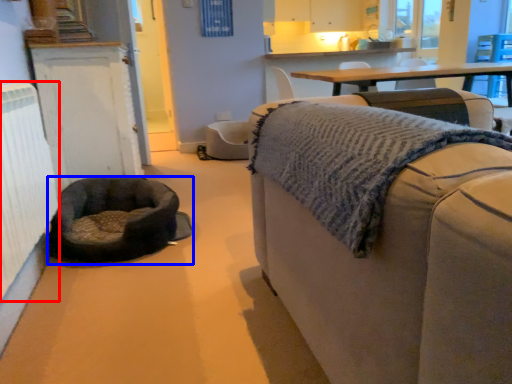
Question: Which point is closer to the camera, radiator (highlighted by a red box) or dog bed (highlighted by a blue box)?

Choices:
 (A) radiator
 (B) dog bed

Answer: (A)